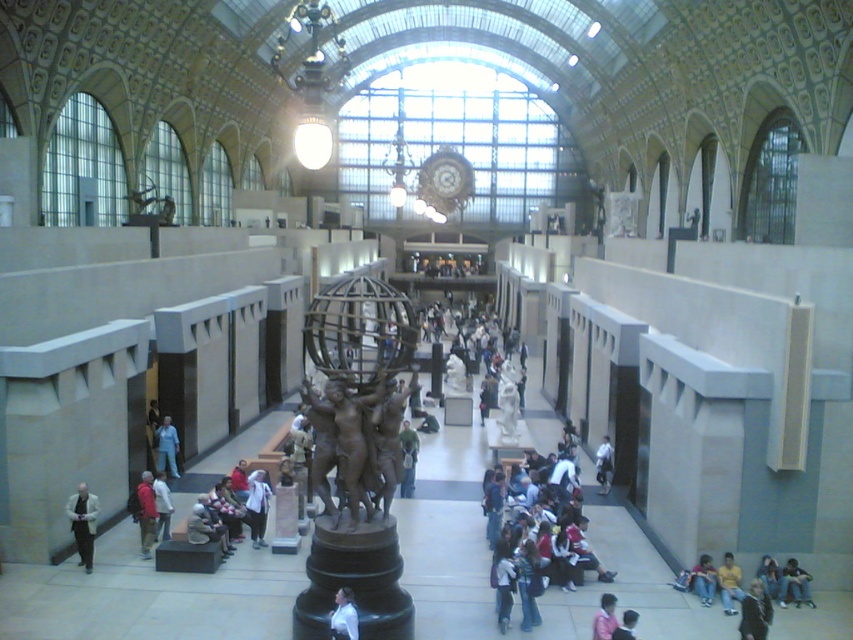
Question: Does green fabric jacket at center appear on the left side of blue denim jeans at lower left?

Choices:
 (A) no
 (B) yes

Answer: (A)

Question: Is bronze/golden statue at center below green fabric jacket at center?

Choices:
 (A) yes
 (B) no

Answer: (B)

Question: Is blue denim jeans at lower right to the right of dark blue shirt at lower right from the viewer's perspective?

Choices:
 (A) no
 (B) yes

Answer: (B)

Question: Estimate the real-world distances between objects in this image. Which object is closer to the pink fabric at lower center?

Choices:
 (A) yellow fabric shirt at lower right
 (B) dark brown suit at center
 (C) green fabric jacket at center
 (D) light blue denim jacket at lower right

Answer: (B)

Question: Which object appears farthest from the camera in this image?

Choices:
 (A) green fabric jacket at center
 (B) blue denim jeans at lower left

Answer: (B)

Question: Which object appears closest to the camera in this image?

Choices:
 (A) blue denim jeans at lower right
 (B) bronze/golden statue at center
 (C) light blue denim jacket at lower right

Answer: (B)